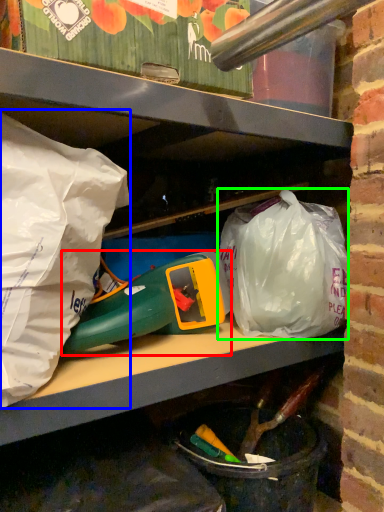
Question: Estimate the real-world distances between objects in this image. Which object is farther from toy (highlighted by a red box), plastic bag (highlighted by a blue box) or plastic bag (highlighted by a green box)?

Choices:
 (A) plastic bag
 (B) plastic bag

Answer: (A)